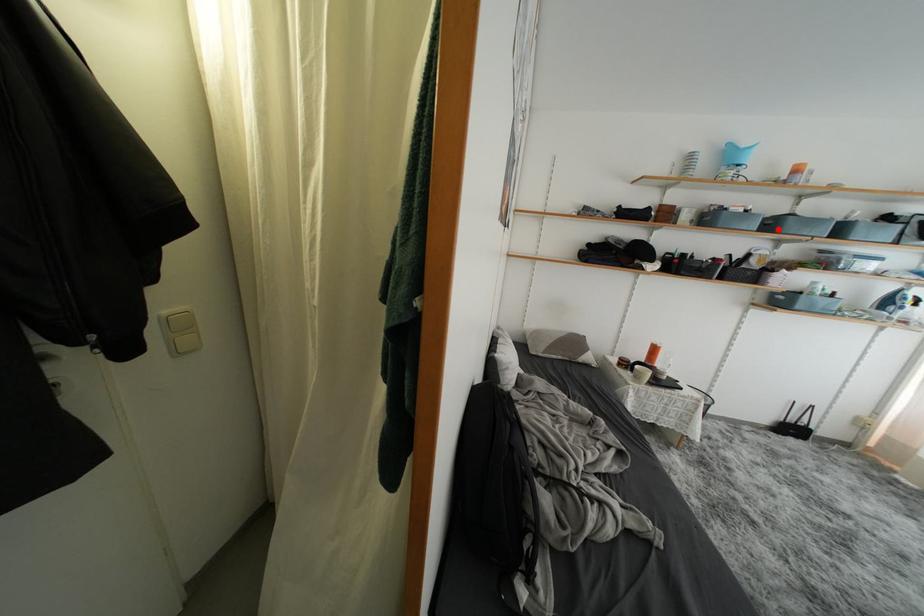
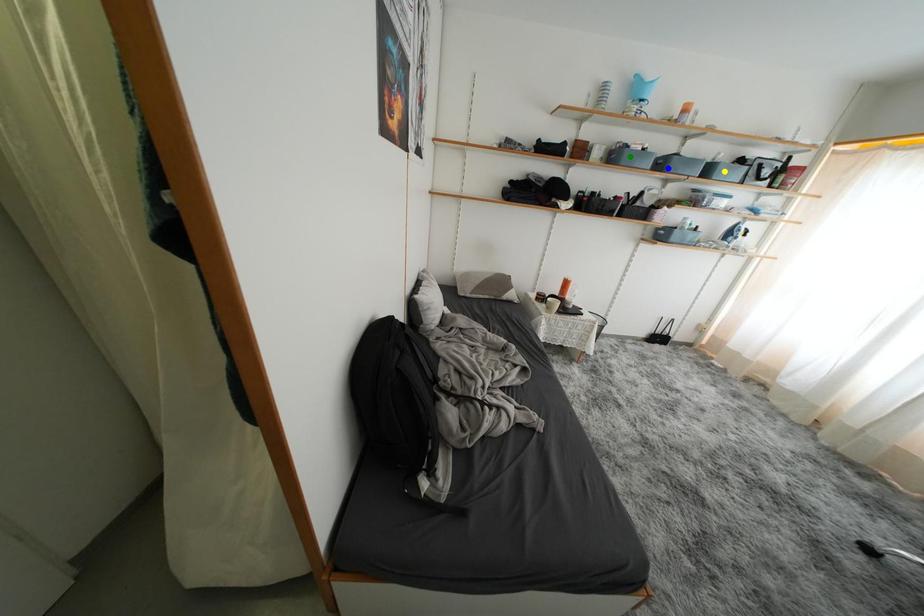
Question: I am providing you with two images of the same scene from different viewpoints. A red point is marked on the first image. You are given multiple points on the second image. Can you choose the point in image 2 that corresponds to the point in image 1?

Choices:
 (A) blue point
 (B) green point
 (C) yellow point

Answer: (A)